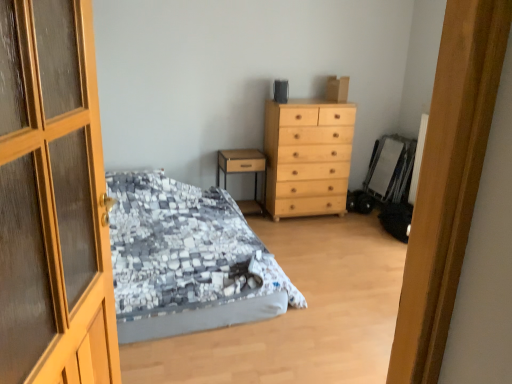
Question: In terms of height, does light wood/texture chest of drawers at center look taller or shorter compared to wooden nightstand at center?

Choices:
 (A) short
 (B) tall

Answer: (B)

Question: Would you say light wood/texture chest of drawers at center is to the left or to the right of wooden nightstand at center in the picture?

Choices:
 (A) left
 (B) right

Answer: (B)

Question: Estimate the real-world distances between objects in this image. Which object is farther from the light wood/texture chest of drawers at center?

Choices:
 (A) wooden nightstand at center
 (B) textured gray bed at center
 (C) wooden door at left

Answer: (C)

Question: Which object is the closest to the wooden nightstand at center?

Choices:
 (A) light wood/texture chest of drawers at center
 (B) textured gray bed at center
 (C) wooden door at left

Answer: (A)